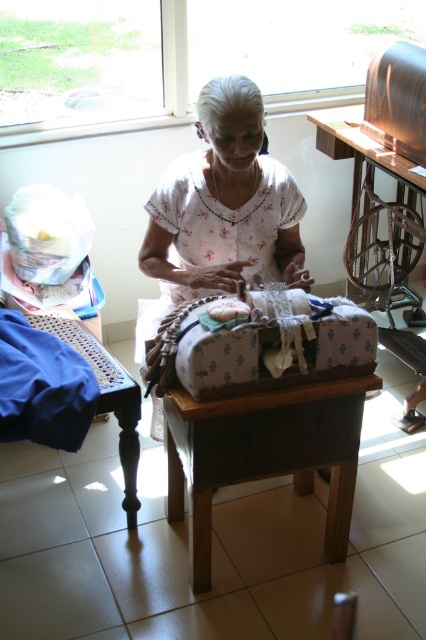
You are a photographer taking a picture of the scene. You notice two points in the image at coordinates point (264, 252) and point (351, 256). Which point is closer to your camera?

Point (264, 252) is closer to the camera than point (351, 256).

You are a guest entering the room and want to sit down at the brown wooden table at center. However, there is a white floral shirt at center in the way. Can you move the shirt to access the table?

The brown wooden table at center is behind the white floral shirt at center, so you can move the white floral shirt at center to access the table.